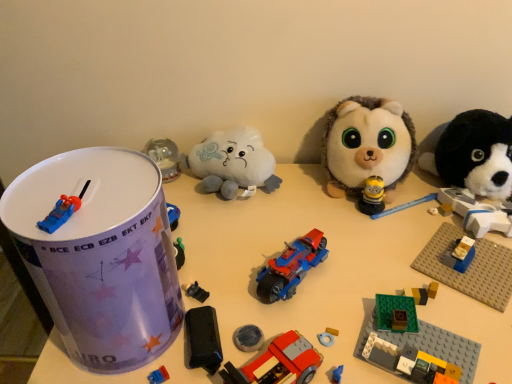
At what (x,y) coordinates should I click in order to perform the action: click on vacant space in between fluffy white plush at center, the 2th toy viewed from the right, and shiny plastic toy car at left, the eighth toy positioned from the right. Please return your answer as a coordinate pair (x, y). Looking at the image, I should click on [275, 237].